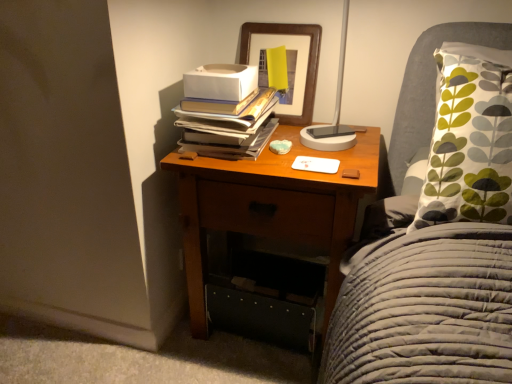
Question: Is wooden picture frame at upper center wider or thinner than hardcover books at upper center?

Choices:
 (A) thin
 (B) wide

Answer: (A)

Question: From a real-world perspective, relative to hardcover books at upper center, is wooden picture frame at upper center vertically above or below?

Choices:
 (A) above
 (B) below

Answer: (A)

Question: Based on their relative distances, which object is farther from the wooden nightstand at center?

Choices:
 (A) hardcover books at upper center
 (B) wooden picture frame at upper center

Answer: (B)

Question: Which object is the farthest from the hardcover books at upper center?

Choices:
 (A) wooden nightstand at center
 (B) wooden picture frame at upper center

Answer: (B)